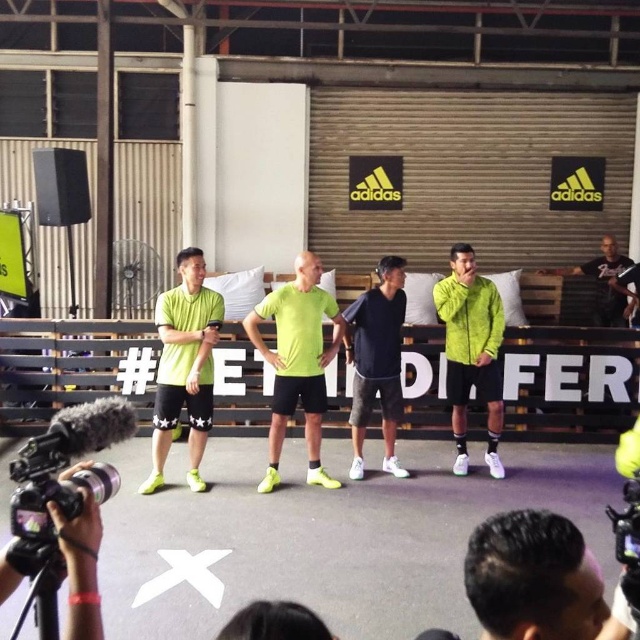
Consider the image. You are a photographer standing in front of the stage. You want to take a photo of the dark blue jersey at center. Where should you aim your camera to capture it?

You should aim your camera at point (376, 362) to capture the dark blue jersey at center.

In the scene shown: You are a photographer standing at the back of the indoor sports facility. You want to take a photo of the group of four individuals on stage. The black matte video camera at lower left is your only equipment. What is the minimum distance you need to move forward to ensure all four individuals are in frame?

The minimum distance you need to move forward is 1.33 meters to ensure all four individuals are in frame with the black matte video camera at lower left.